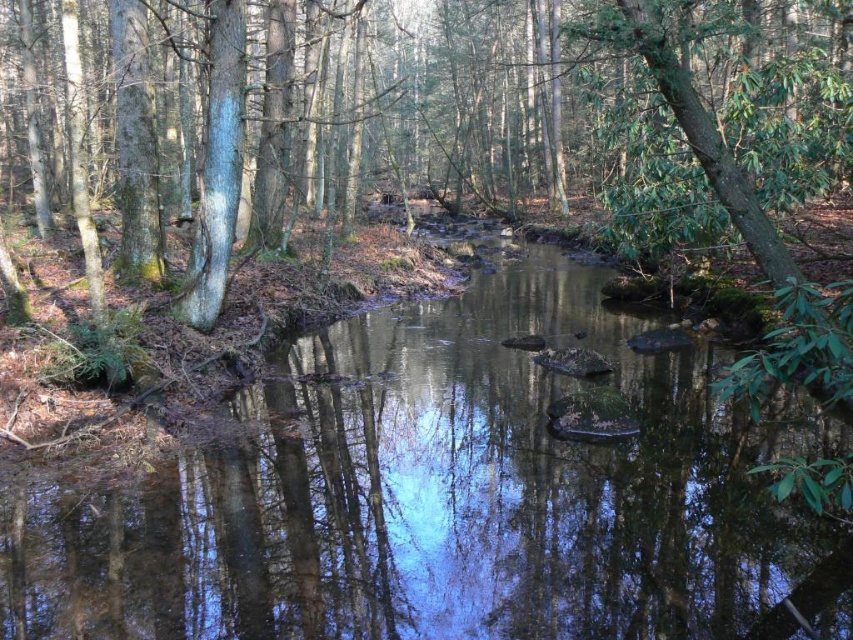
You are a hiker standing at the edge of the forest. You see the clear water at center and the green leafy tree at center. Which object is closer to the ground?

The clear water at center is shorter than the green leafy tree at center, so the clear water at center is closer to the ground.

You are standing in the forest scene looking at the stream. There are two points marked in the image. Which point, point (x=619, y=452) or point (x=660, y=140), is closer to you?

Point (x=619, y=452) is closer to you than point (x=660, y=140).

Looking at this image, you are a hiker trying to cross the stream in the forest. You see the clear water at center and the green leafy tree at center. Which one is narrower in width?

The clear water at center has a lesser width compared to the green leafy tree at center, so the clear water at center is narrower in width.